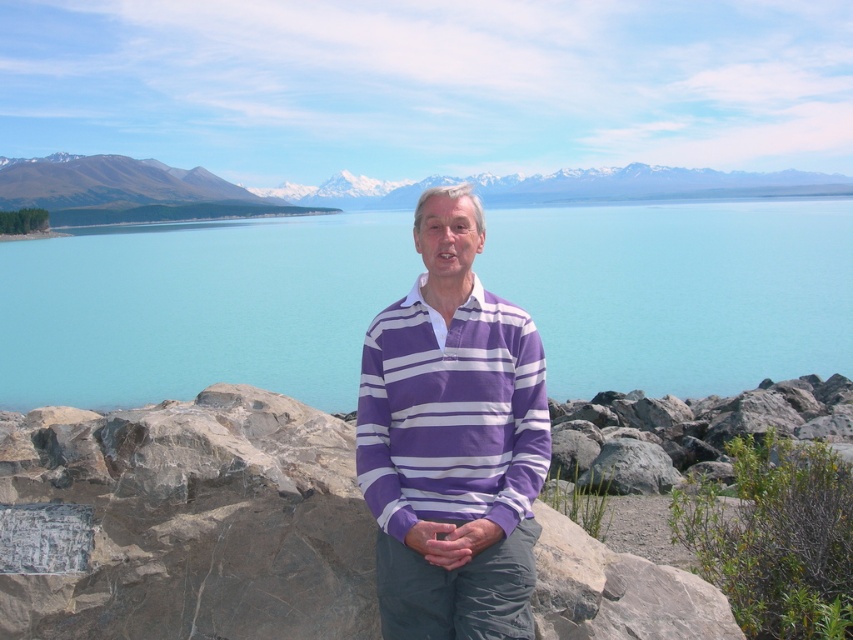
Question: Is turquoise water at center to the right of white snow-covered mountain at upper center from the viewer's perspective?

Choices:
 (A) yes
 (B) no

Answer: (B)

Question: Which of the following is the closest to the observer?

Choices:
 (A) purple striped sweater at center
 (B) white snow-covered mountain at upper center

Answer: (A)

Question: Does turquoise water at center have a smaller size compared to white snow-covered mountain at upper center?

Choices:
 (A) yes
 (B) no

Answer: (B)

Question: Does turquoise water at center have a smaller size compared to white snow-covered mountain at upper center?

Choices:
 (A) yes
 (B) no

Answer: (B)

Question: Which of the following is the closest to the observer?

Choices:
 (A) purple striped sweater at center
 (B) white snow-covered mountain at upper center

Answer: (A)

Question: Which object is the closest to the turquoise water at center?

Choices:
 (A) purple striped sweater at center
 (B) white snow-covered mountain at upper center

Answer: (A)